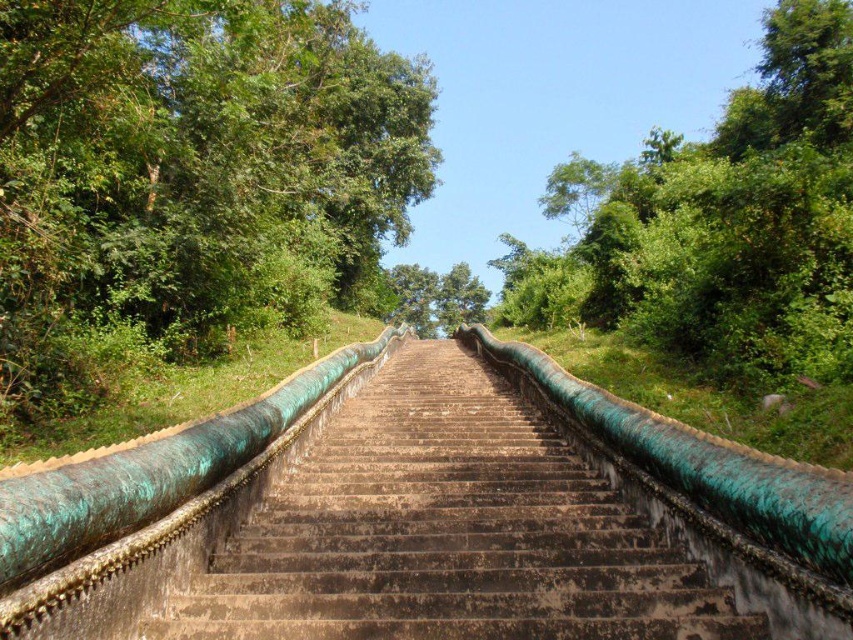
You are standing at the bottom of the staircase and want to walk towards the green leafy tree at upper left and the green leafy tree at upper right. Which tree will you reach first if you walk straight ahead?

The green leafy tree at upper left is closer to you than the green leafy tree at upper right, so you will reach the green leafy tree at upper left first.